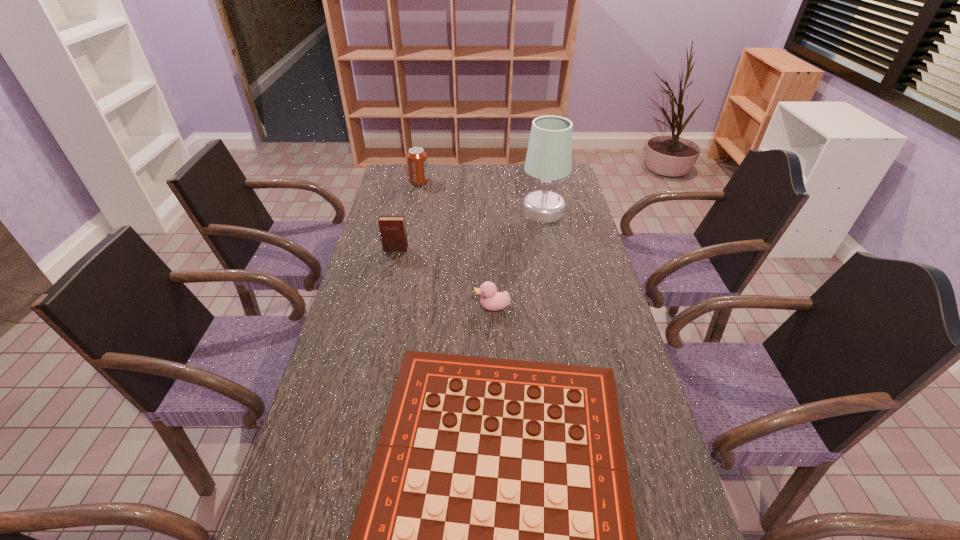
I want to click on lampshade, so click(x=549, y=154).

You are a GUI agent. You are given a task and a screenshot of the screen. Output one action in this format:
    pyautogui.click(x=<x>, y=<y>)
    Task: Click on the tallest object
    The image size is (960, 540).
    Given the screenshot: What is the action you would take?
    pyautogui.click(x=549, y=154)

Find the location of a particular element. the farthest object is located at coordinates (417, 163).

Where is `the third nearest object`? The image size is (960, 540). the third nearest object is located at coordinates (393, 234).

Identify the location of the second shortest object. (491, 300).

I want to click on the second nearest object, so click(491, 300).

Identify the location of vacant region located on the base of the second farthest object. (559, 289).

Where is `vacant space located on the right of the can`? vacant space located on the right of the can is located at coordinates (465, 181).

You are a GUI agent. You are given a task and a screenshot of the screen. Output one action in this format:
    pyautogui.click(x=<x>, y=<y>)
    Task: Click on the free space located on the front cover of the third farthest object
    The height and width of the screenshot is (540, 960).
    Given the screenshot: What is the action you would take?
    pyautogui.click(x=376, y=331)

You are a GUI agent. You are given a task and a screenshot of the screen. Output one action in this format:
    pyautogui.click(x=<x>, y=<y>)
    Task: Click on the vacant space located on the front-facing side of the duckling
    The height and width of the screenshot is (540, 960).
    Given the screenshot: What is the action you would take?
    pyautogui.click(x=451, y=307)